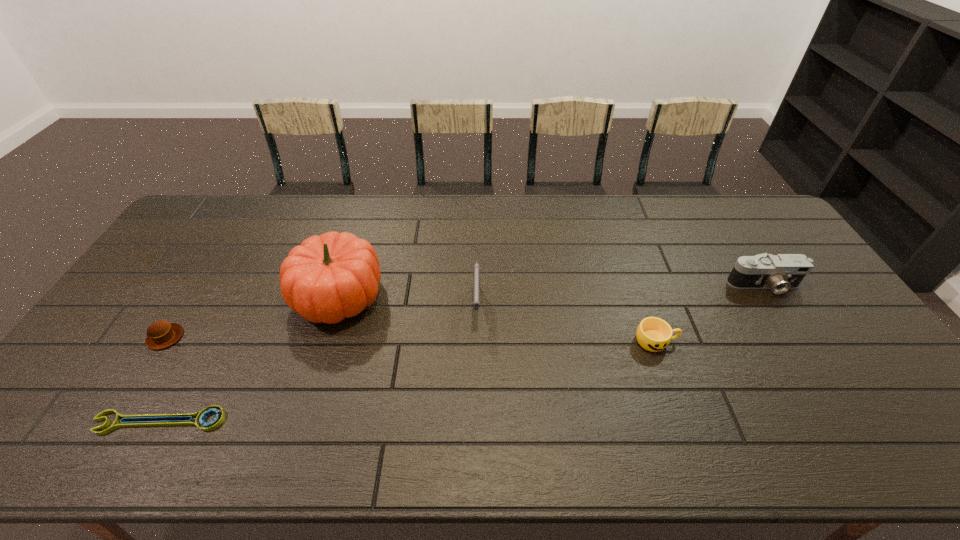
You are a GUI agent. You are given a task and a screenshot of the screen. Output one action in this format:
    pyautogui.click(x=<x>, y=<y>)
    Task: Click on the vacant space positioned on the lens of the rightmost object
    Image resolution: width=960 pixels, height=540 pixels.
    Given the screenshot: What is the action you would take?
    pyautogui.click(x=782, y=315)

Image resolution: width=960 pixels, height=540 pixels. I want to click on free space located 0.200m on the left of the fifth object from left to right, so click(x=561, y=341).

Where is `vacant space situated on the front of the muffin`? This screenshot has height=540, width=960. vacant space situated on the front of the muffin is located at coordinates (147, 367).

Find the location of a particular element. vacant area situated 0.380m on the back of the wrench is located at coordinates (230, 292).

Where is `object that is at the near edge`? This screenshot has width=960, height=540. object that is at the near edge is located at coordinates (200, 416).

The image size is (960, 540). What are the coordinates of `muffin located in the left edge section of the desktop` in the screenshot? It's located at (161, 334).

Find the location of a particular element. The width and height of the screenshot is (960, 540). wrench that is at the left edge is located at coordinates (200, 416).

Locate an element on the screen. The width and height of the screenshot is (960, 540). object situated at the right edge is located at coordinates (781, 272).

Identify the location of object located in the near left corner section of the desktop. (200, 416).

In the image, there is a desktop. What are the coordinates of `vacant space at the far edge` in the screenshot? It's located at (307, 208).